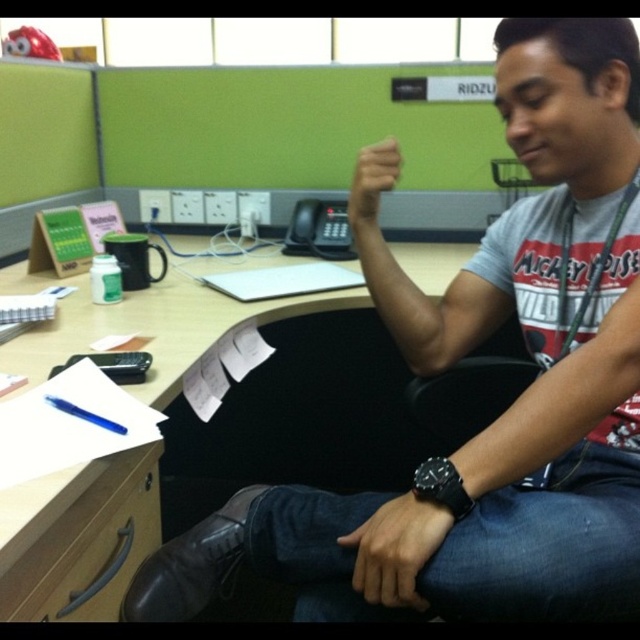
Which is below, wooden desk at center or black leather watch at lower center?

Positioned lower is black leather watch at lower center.

This screenshot has height=640, width=640. What are the coordinates of `wooden desk at center` in the screenshot? It's located at (154, 320).

The height and width of the screenshot is (640, 640). Find the location of `black leather watch at lower center`. black leather watch at lower center is located at coordinates coord(396,548).

Is black leather watch at lower center to the left of matte skin hand at center from the viewer's perspective?

No, black leather watch at lower center is not to the left of matte skin hand at center.

Locate an element on the screen. black leather watch at lower center is located at coordinates (396, 548).

Who is more distant from viewer, (406, 544) or (100, 422)?

The point (100, 422) is behind.

Who is positioned more to the left, black leather watch at lower center or blue plastic pen at lower left?

Positioned to the left is blue plastic pen at lower left.

Is point (428, 560) positioned in front of point (64, 410)?

Yes, it is in front of point (64, 410).

You are a GUI agent. You are given a task and a screenshot of the screen. Output one action in this format:
    pyautogui.click(x=<x>, y=<y>)
    Task: Click on the black leather watch at lower center
    This screenshot has width=640, height=640.
    Given the screenshot: What is the action you would take?
    pyautogui.click(x=396, y=548)